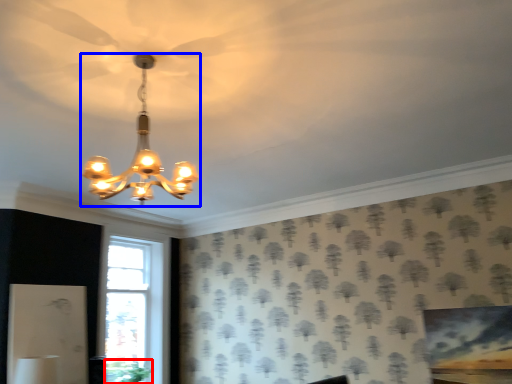
Question: Which object is closer to the camera taking this photo, plant (highlighted by a red box) or lamp (highlighted by a blue box)?

Choices:
 (A) plant
 (B) lamp

Answer: (B)